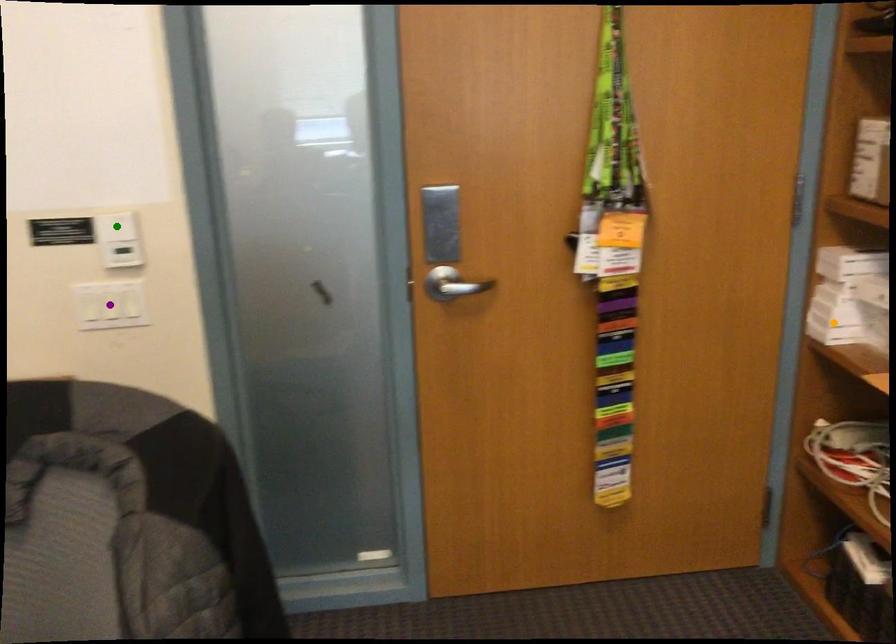
Order these from nearest to farthest:
- green point
- purple point
- orange point

green point < purple point < orange point